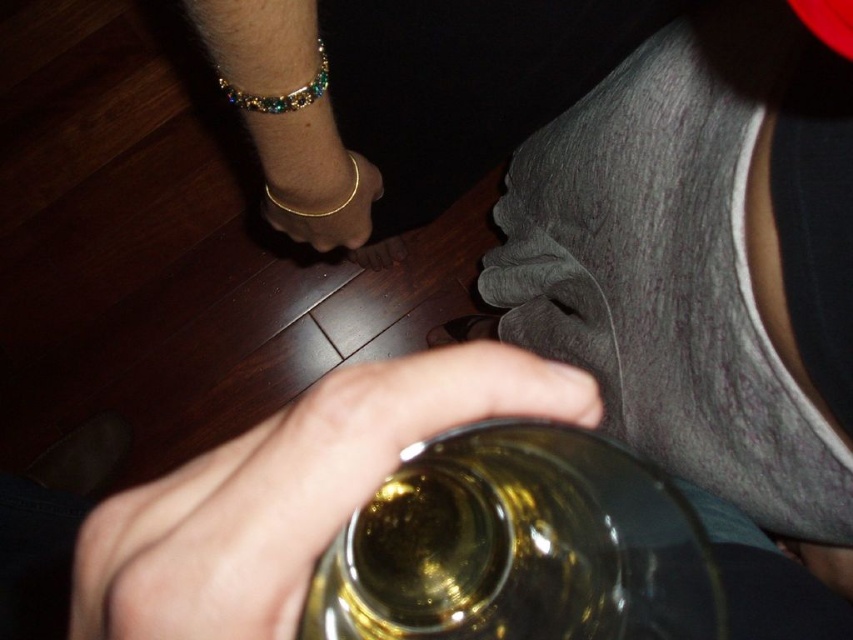
This screenshot has height=640, width=853. What do you see at coordinates (279, 93) in the screenshot?
I see `multicolored gemstone bracelet at upper left` at bounding box center [279, 93].

Does point (311, 97) come behind point (351, 152)?

No, it is in front of (351, 152).

Does point (251, 109) come farther from viewer compared to point (357, 179)?

No, it is in front of (357, 179).

At what (x,y) coordinates should I click in order to perform the action: click on multicolored gemstone bracelet at upper left. Please return your answer as a coordinate pair (x, y). The height and width of the screenshot is (640, 853). Looking at the image, I should click on (279, 93).

Can you confirm if translucent glass at lower center is shorter than multicolored gemstone bracelet at upper left?

In fact, translucent glass at lower center may be taller than multicolored gemstone bracelet at upper left.

At what (x,y) coordinates should I click in order to perform the action: click on translucent glass at lower center. Please return your answer as a coordinate pair (x, y). Looking at the image, I should click on (289, 493).

I want to click on translucent glass at lower center, so click(289, 493).

Does point (432, 531) come farther from viewer compared to point (355, 173)?

No.

Which is behind, point (656, 634) or point (332, 212)?

The point (332, 212) is more distant.

Who is more distant from viewer, [390,595] or [268,198]?

Point [268,198]

In order to click on translucent glass bottle at lower center in this screenshot , I will do `click(518, 547)`.